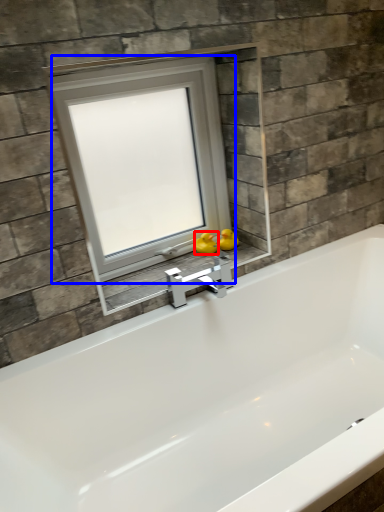
Question: Which of the following is the farthest to the observer, duck (highlighted by a red box) or window (highlighted by a blue box)?

Choices:
 (A) duck
 (B) window

Answer: (A)